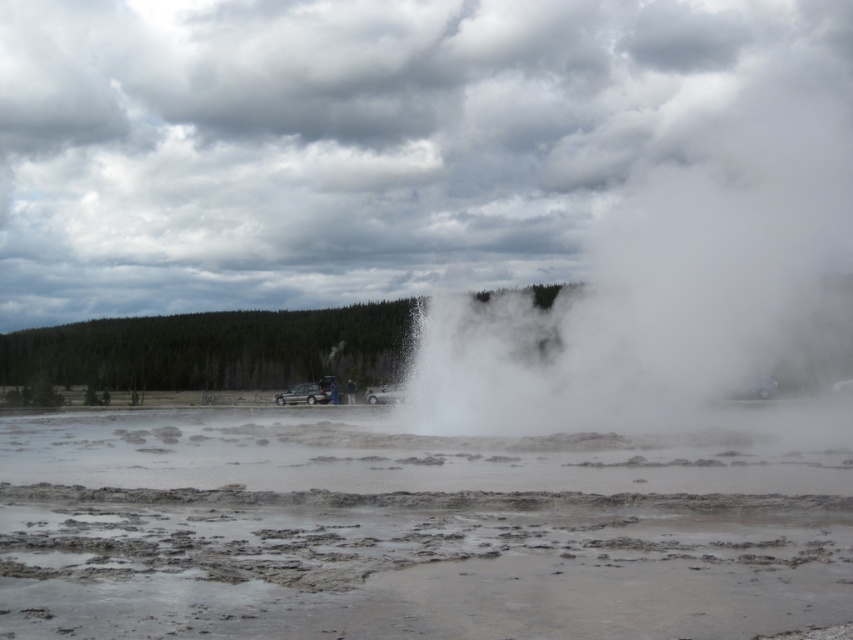
Is muddy water at center shorter than white vapor at center?

Correct, muddy water at center is not as tall as white vapor at center.

What do you see at coordinates (416, 529) in the screenshot? This screenshot has width=853, height=640. I see `muddy water at center` at bounding box center [416, 529].

This screenshot has height=640, width=853. I want to click on muddy water at center, so click(x=416, y=529).